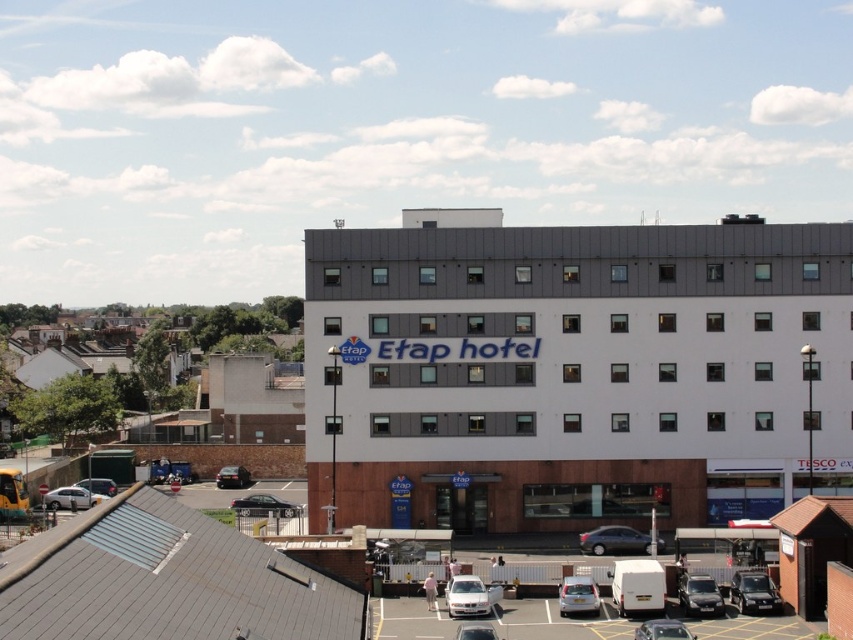
Measure the distance between point (640, 538) and camera.

The distance of point (640, 538) from camera is 69.04 meters.

Does metallic gray sedan at center have a greater height compared to silver metallic sedan at lower left?

Correct, metallic gray sedan at center is much taller as silver metallic sedan at lower left.

The width and height of the screenshot is (853, 640). Describe the element at coordinates (613, 540) in the screenshot. I see `metallic gray sedan at center` at that location.

Where is `metallic gray sedan at center`? The height and width of the screenshot is (640, 853). metallic gray sedan at center is located at coordinates (613, 540).

Where is `metallic silver sedan at center`? This screenshot has width=853, height=640. metallic silver sedan at center is located at coordinates (264, 506).

Is metallic silver sedan at center closer to camera compared to silver metallic sedan at lower left?

Yes, metallic silver sedan at center is closer to the viewer.

Is point (287, 502) more distant than point (68, 499)?

Yes.

In order to click on metallic silver sedan at center in this screenshot , I will do click(264, 506).

Is matte silver car at lower right to the right of silver metallic hatchback at center from the viewer's perspective?

Indeed, matte silver car at lower right is positioned on the right side of silver metallic hatchback at center.

Can you confirm if matte silver car at lower right is thinner than silver metallic hatchback at center?

Indeed, matte silver car at lower right has a lesser width compared to silver metallic hatchback at center.

Image resolution: width=853 pixels, height=640 pixels. Find the location of `matte silver car at lower right`. matte silver car at lower right is located at coordinates (699, 595).

You are a GUI agent. You are given a task and a screenshot of the screen. Output one action in this format:
    pyautogui.click(x=<x>, y=<y>)
    Task: Click on the matte silver car at lower right
    The height and width of the screenshot is (640, 853).
    Given the screenshot: What is the action you would take?
    pyautogui.click(x=699, y=595)